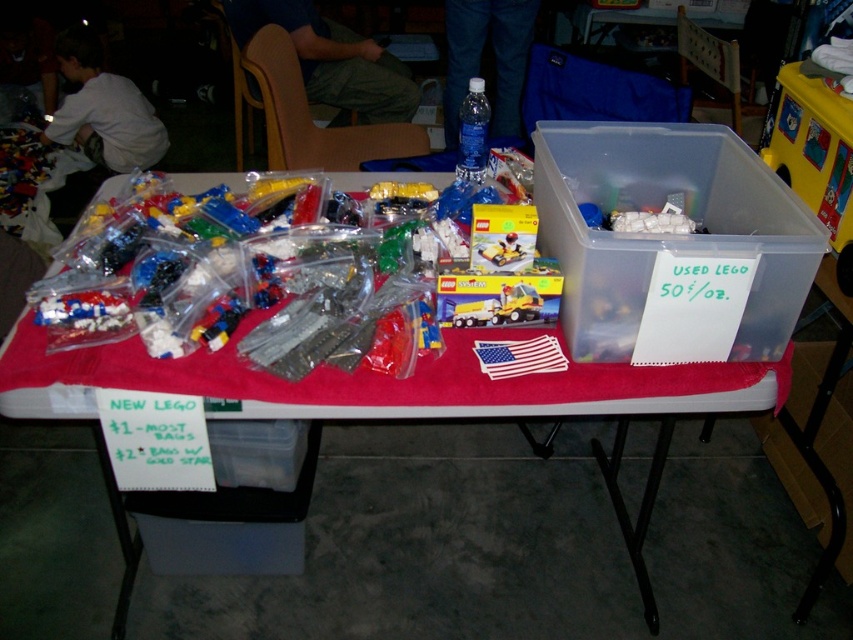
You are standing at the LEGO selling table and want to pick up an item. There are two points on the table marked as point (741,408) and point (468,104). Which point is closer to you?

Point (741,408) is closer to the viewer than point (468,104).

You are a customer standing in front of the table. You want to buy some LEGO pieces. Which item would you reach first if you want to grab something from the red fabric table at center and the transparent plastic bottle at upper center?

The red fabric table at center is closer to the viewer than the transparent plastic bottle at upper center, so you would reach the red fabric table at center first.